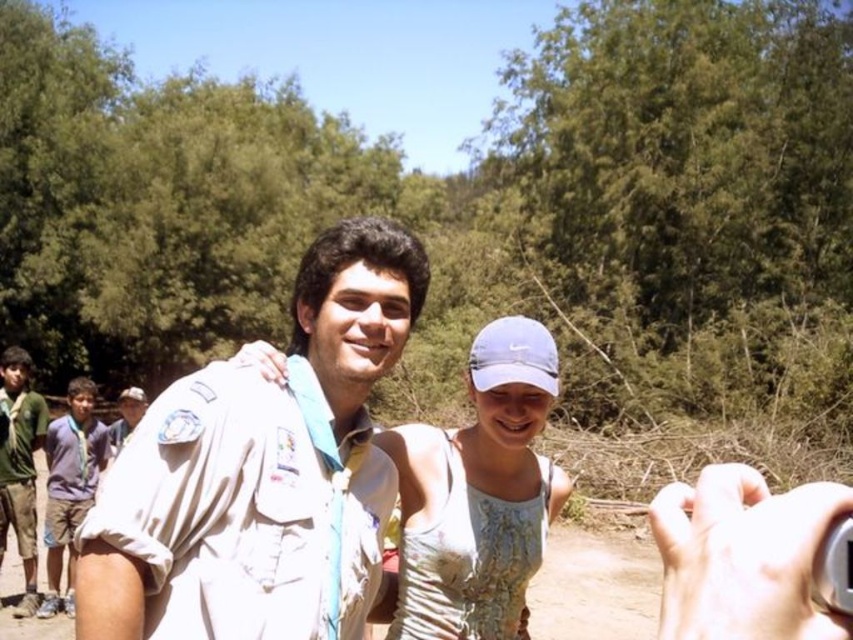
Can you confirm if white cotton tank top at center is thinner than blue cotton shirt at left?

No.

Is point (397, 467) closer to camera compared to point (44, 540)?

Yes, point (397, 467) is closer to viewer.

Does point (485, 465) come farther from viewer compared to point (68, 577)?

That is False.

Where is `white cotton tank top at center`? Image resolution: width=853 pixels, height=640 pixels. white cotton tank top at center is located at coordinates (479, 493).

This screenshot has height=640, width=853. What do you see at coordinates (260, 472) in the screenshot?
I see `white uniform shirt at center` at bounding box center [260, 472].

Between white uniform shirt at center and blue cotton shirt at left, which one appears on the left side from the viewer's perspective?

Positioned to the left is blue cotton shirt at left.

This screenshot has height=640, width=853. Describe the element at coordinates (260, 472) in the screenshot. I see `white uniform shirt at center` at that location.

You are a GUI agent. You are given a task and a screenshot of the screen. Output one action in this format:
    pyautogui.click(x=<x>, y=<y>)
    Task: Click on the white uniform shirt at center
    The width and height of the screenshot is (853, 640).
    Given the screenshot: What is the action you would take?
    coord(260,472)

Which is more to the left, white cotton tank top at center or green uniform at left?

From the viewer's perspective, green uniform at left appears more on the left side.

Between white cotton tank top at center and green uniform at left, which one has more height?

green uniform at left is taller.

Where is `white cotton tank top at center`? white cotton tank top at center is located at coordinates (479, 493).